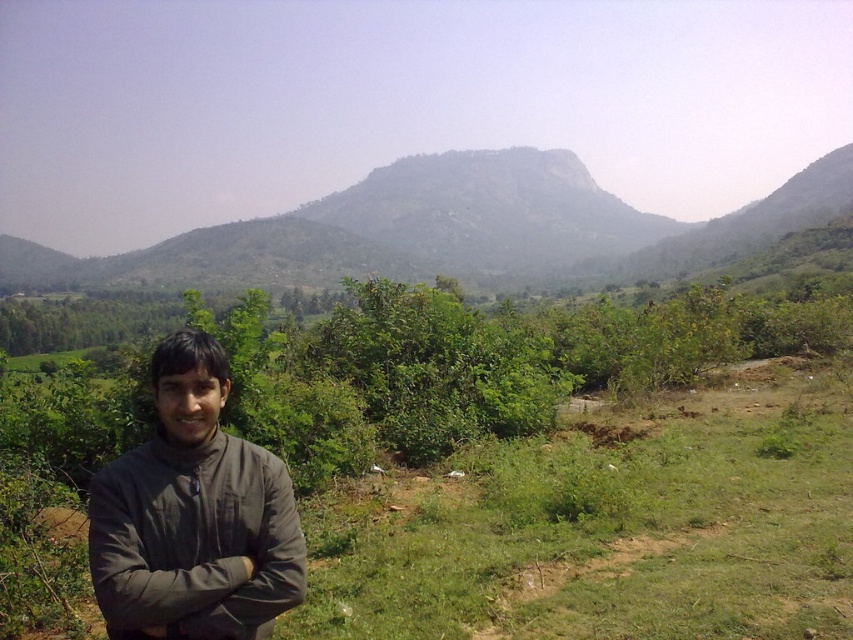
You are a hiker trying to locate the dark gray jacket at lower left from the green textured mountain at center. Which direction should you move to find it?

The dark gray jacket at lower left is to the right of the green textured mountain at center, so you should move to the right to find it.

You are standing at the point closest to the bottom edge of the image. Which of the two points, point (830, 186) or point (160, 582), is farther away from you?

Point (830, 186) is farther away from you because it is positioned behind point (160, 582) in the scene.

You are a hiker planning to take a photo of the green textured mountain at center from a specific spot. The coordinates provided indicate its position in the image. If you want to frame the mountain so it occupies the central part of your photo, should you adjust your position to the left or right?

The green textured mountain at center is already positioned at the center of the image based on the coordinates given, so no adjustment to the left or right is needed.